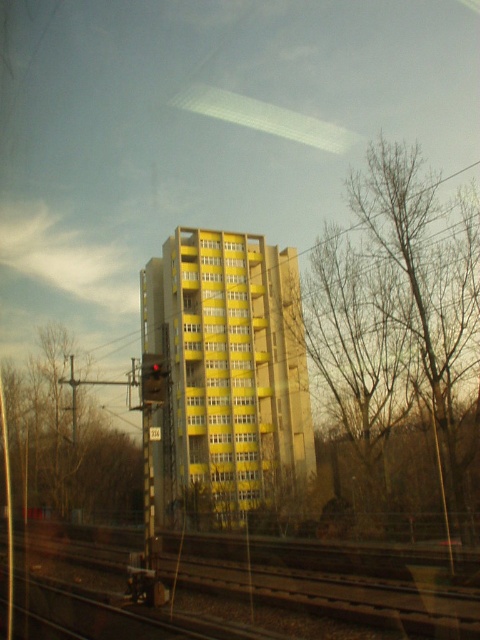
Find the location of a particular element. bare branches at left is located at coordinates (67, 444).

Which of these two, bare branches at left or red glass traffic light at center, stands shorter?

With less height is red glass traffic light at center.

Between point (24, 468) and point (154, 374), which one is positioned behind?

The point (24, 468) is behind.

Find the location of a particular element. The height and width of the screenshot is (640, 480). bare branches at left is located at coordinates (67, 444).

Can you confirm if brown gravel train track at lower left is wider than bare branches at left?

No.

Can you confirm if brown gravel train track at lower left is thinner than bare branches at left?

Yes.

Who is more forward, (x=222, y=586) or (x=69, y=429)?

Point (x=222, y=586) is more forward.

The image size is (480, 640). Find the location of `brown gravel train track at lower left`. brown gravel train track at lower left is located at coordinates (334, 580).

Is bare wood tree at right wider than red glass traffic light at center?

Indeed, bare wood tree at right has a greater width compared to red glass traffic light at center.

Which is more to the right, bare wood tree at right or red glass traffic light at center?

From the viewer's perspective, bare wood tree at right appears more on the right side.

Consider the image. Who is more distant from viewer, (387, 324) or (147, 397)?

Point (387, 324)

Image resolution: width=480 pixels, height=640 pixels. I want to click on bare wood tree at right, so click(398, 314).